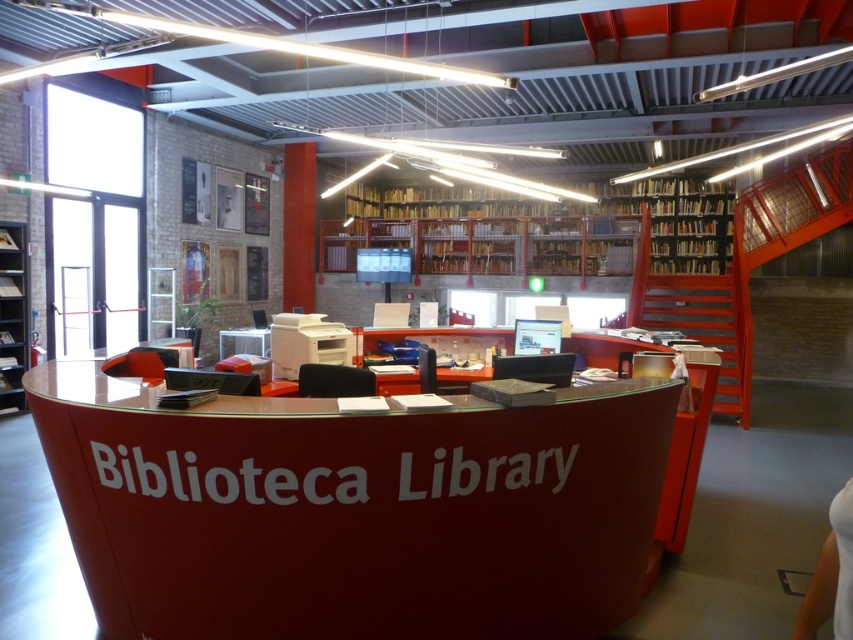
Is point (526, 584) farther from viewer compared to point (672, 220)?

No.

Is glossy red table at center to the left of wooden shelves at upper center from the viewer's perspective?

Correct, you'll find glossy red table at center to the left of wooden shelves at upper center.

Locate an element on the screen. glossy red table at center is located at coordinates (354, 509).

At what (x,y) coordinates should I click in order to perform the action: click on glossy red table at center. Please return your answer as a coordinate pair (x, y). Looking at the image, I should click on (354, 509).

Is wooden shelves at upper center bigger than metallic gray bookshelf at left?

Actually, wooden shelves at upper center might be smaller than metallic gray bookshelf at left.

Between point (614, 264) and point (3, 336), which one is positioned in front?

Point (3, 336) is in front.

Is point (697, 236) less distant than point (9, 381)?

No, it is not.

Image resolution: width=853 pixels, height=640 pixels. What are the coordinates of `wooden shelves at upper center` in the screenshot? It's located at pyautogui.click(x=674, y=221).

Which is behind, point (625, 545) or point (1, 292)?

Point (1, 292)

Which is behind, point (88, 593) or point (3, 381)?

Point (3, 381)

I want to click on glossy red table at center, so click(x=354, y=509).